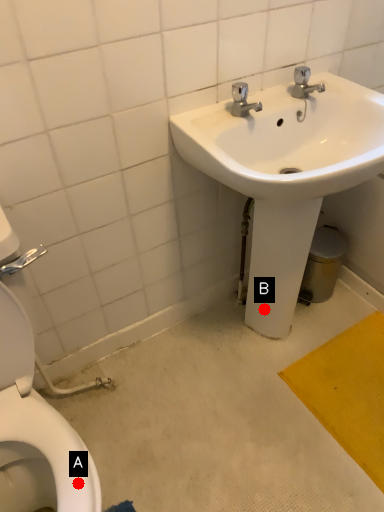
Question: Two points are circled on the image, labeled by A and B beside each circle. Which of the following is the closest to the observer?

Choices:
 (A) A is closer
 (B) B is closer

Answer: (A)